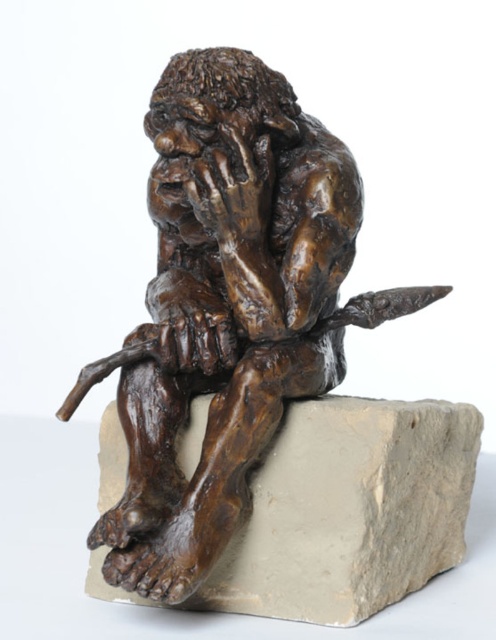
Question: Which of the following is the farthest from the observer?

Choices:
 (A) (345, 262)
 (B) (204, 396)

Answer: (B)

Question: Is bronze statue at center in front of gray stone at center?

Choices:
 (A) yes
 (B) no

Answer: (A)

Question: Is bronze statue at center closer to camera compared to gray stone at center?

Choices:
 (A) yes
 (B) no

Answer: (A)

Question: Among these points, which one is farthest from the camera?

Choices:
 (A) (285, 600)
 (B) (300, 298)

Answer: (A)

Question: Does bronze statue at center appear on the left side of gray stone at center?

Choices:
 (A) yes
 (B) no

Answer: (A)